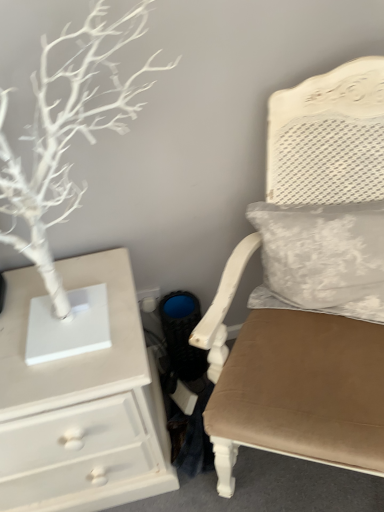
Question: Would you say velvet beige chair at center is inside or outside white textured pillow at upper right?

Choices:
 (A) inside
 (B) outside

Answer: (B)

Question: From a real-world perspective, relative to white textured pillow at upper right, is velvet beige chair at center vertically above or below?

Choices:
 (A) below
 (B) above

Answer: (A)

Question: Which of these objects is positioned farthest from the white textured pillow at upper right?

Choices:
 (A) white painted wood chest of drawers at left
 (B) white matte tree at left
 (C) velvet beige chair at center

Answer: (B)

Question: Based on their relative distances, which object is nearer to the white painted wood chest of drawers at left?

Choices:
 (A) velvet beige chair at center
 (B) white matte tree at left
 (C) white textured pillow at upper right

Answer: (A)